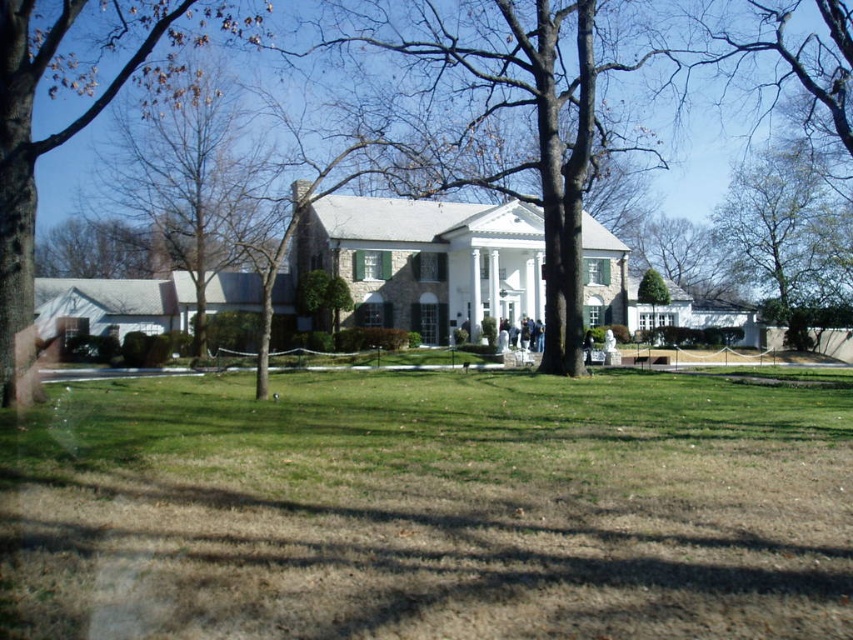
Between green leafy tree at center and brown leafy tree at upper left, which one is positioned lower?

brown leafy tree at upper left is lower down.

Between green leafy tree at center and brown leafy tree at upper left, which one appears on the left side from the viewer's perspective?

brown leafy tree at upper left is more to the left.

Is point (561, 125) behind point (115, 26)?

Yes, it is behind point (115, 26).

Identify the location of green leafy tree at center. The image size is (853, 640). (518, 108).

Where is `green leafy tree at center`? green leafy tree at center is located at coordinates (518, 108).

Who is lower down, green leafy tree at center or green leafy tree at upper right?

Positioned lower is green leafy tree at upper right.

Which is behind, point (508, 77) or point (780, 198)?

Positioned behind is point (780, 198).

The image size is (853, 640). Identify the location of green leafy tree at center. (518, 108).

Who is lower down, green grass at center or green leafy tree at center?

green grass at center is below.

Who is taller, green grass at center or green leafy tree at center?

green leafy tree at center is taller.

Is point (697, 540) positioned behind point (550, 195)?

No, (697, 540) is closer to viewer.

Identify the location of green grass at center. This screenshot has width=853, height=640. point(428,509).